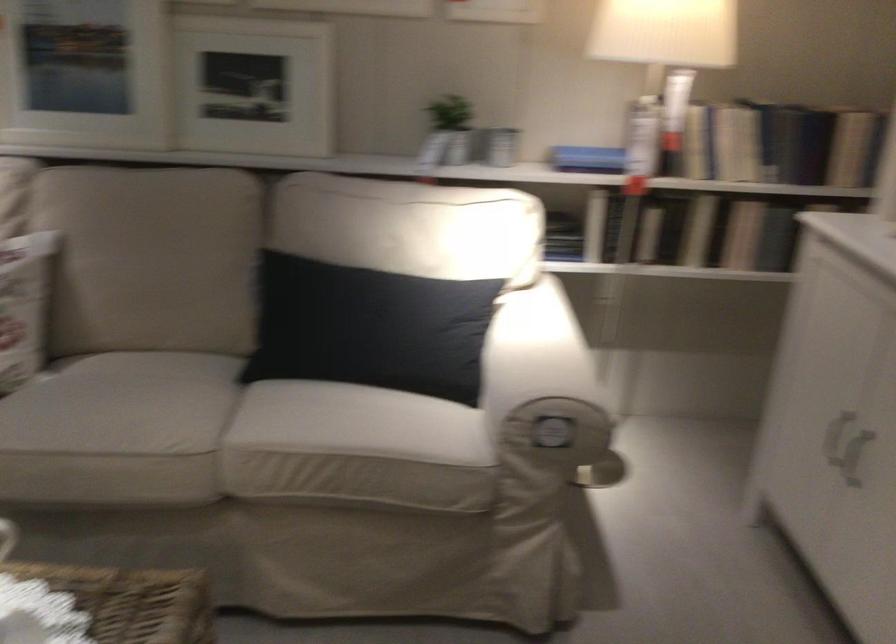
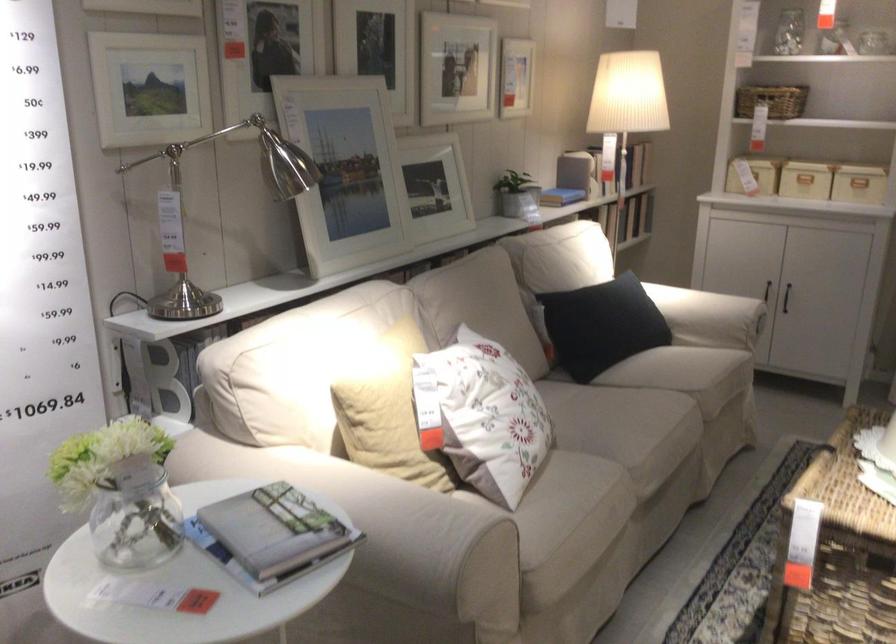
Where in the second image is the point corresponding to point (555, 164) from the first image?

(561, 194)